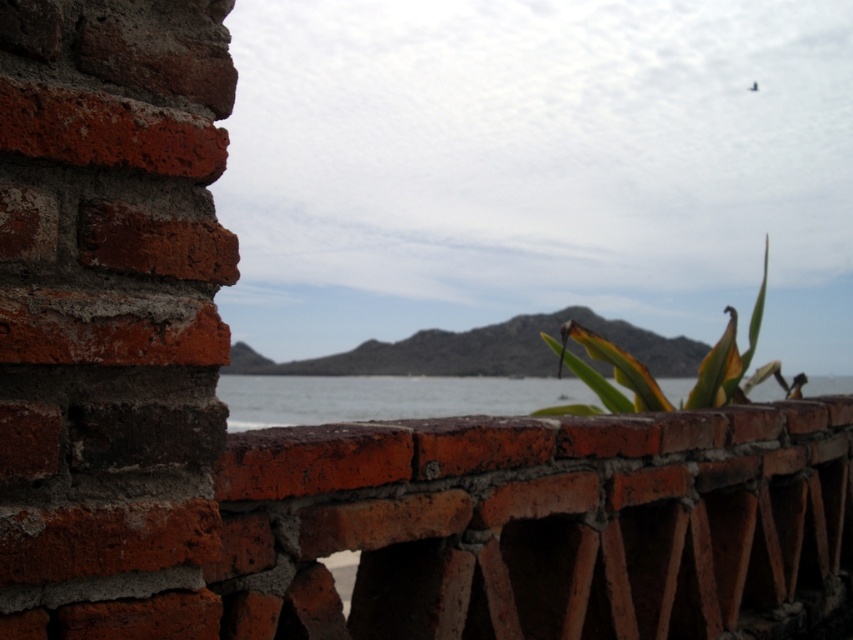
You are standing in front of the brick wall and see the clear water at center and the green leafy plant at center. Which one is wider?

The clear water at center might be wider than green leafy plant at center according to the description.

You are standing in front of a brick wall with two points marked on it. The first point is at coordinates point (527, 390) and the second is at point (758, 381). Which point is closer to you?

Point (527, 390) is further to the camera than point (758, 381), so the point closer to you is point (758, 381).